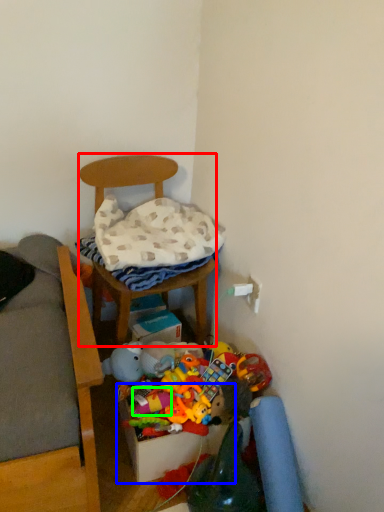
Question: Based on their relative distances, which object is farther from furniture (highlighted by a red box)? Choose from storage box (highlighted by a blue box) and toy (highlighted by a green box).

Choices:
 (A) storage box
 (B) toy

Answer: (A)